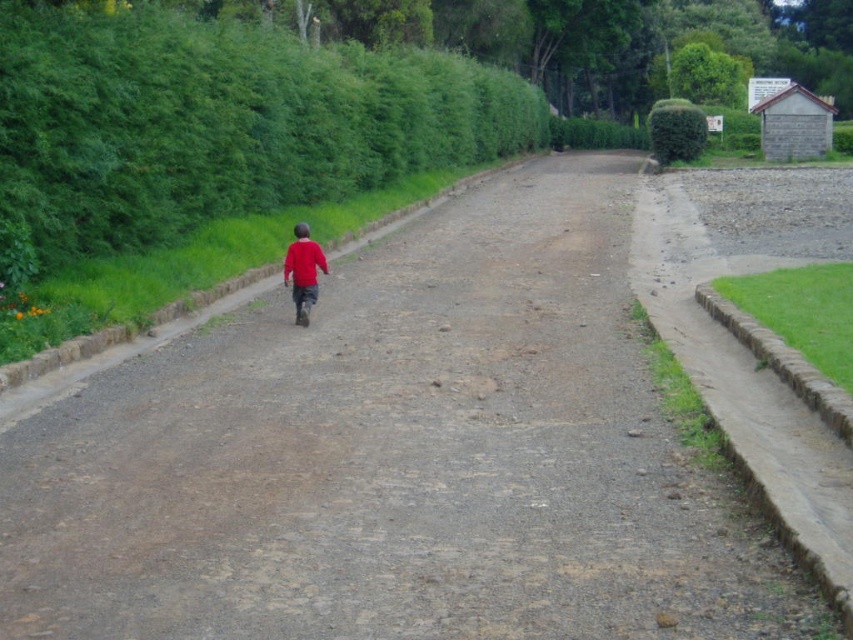
You are standing on the road in the rural scene and notice a green leafy hedge at upper left and a red matte shirt at center. Which object is nearer to you?

The green leafy hedge at upper left is closer to the viewer than the red matte shirt at center.

You are a gardener standing on the road between the green leafy hedge at upper left and the green leafy hedge at upper right. Which hedge is directly above the other?

The green leafy hedge at upper left is positioned under the green leafy hedge at upper right, meaning the green leafy hedge at upper right is directly above the green leafy hedge at upper left.

You are standing on the unpaved road in the rural scene. You see a green leafy hedge at upper right and a red matte shirt at center. Which object is closer to you?

The green leafy hedge at upper right is closer to you because it is further to the viewer than the red matte shirt at center.